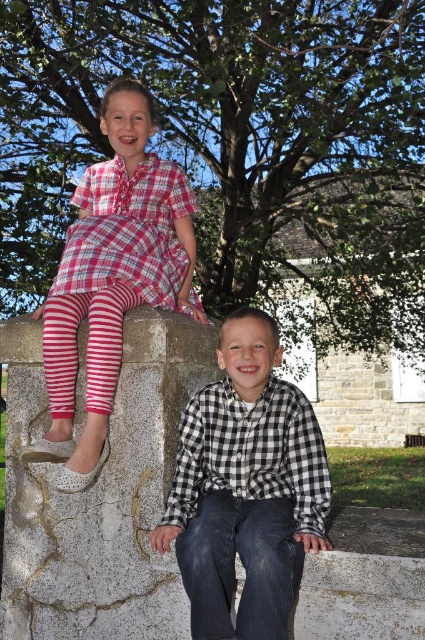
Does black checkered shirt at center have a smaller size compared to plaid fabric dress at upper left?

Indeed, black checkered shirt at center has a smaller size compared to plaid fabric dress at upper left.

Does black checkered shirt at center appear under plaid fabric dress at upper left?

Yes, black checkered shirt at center is below plaid fabric dress at upper left.

Who is more distant from viewer, (260, 579) or (156, 266)?

Point (156, 266)

Where is `black checkered shirt at center`? The height and width of the screenshot is (640, 425). black checkered shirt at center is located at coordinates (246, 488).

Between plaid fabric dress at upper left and black checkered shirt at lower center, which one appears on the left side from the viewer's perspective?

Positioned to the left is plaid fabric dress at upper left.

Is point (113, 157) farther from viewer compared to point (280, 404)?

Yes, it is.

The width and height of the screenshot is (425, 640). Find the location of `plaid fabric dress at upper left`. plaid fabric dress at upper left is located at coordinates (113, 276).

Consider the image. Does gray concrete at center appear on the left side of black checkered shirt at lower center?

Yes, gray concrete at center is to the left of black checkered shirt at lower center.

Between gray concrete at center and black checkered shirt at lower center, which one is positioned higher?

black checkered shirt at lower center

The image size is (425, 640). What do you see at coordinates (99, 492) in the screenshot?
I see `gray concrete at center` at bounding box center [99, 492].

Where is `gray concrete at center`? This screenshot has height=640, width=425. gray concrete at center is located at coordinates (99, 492).